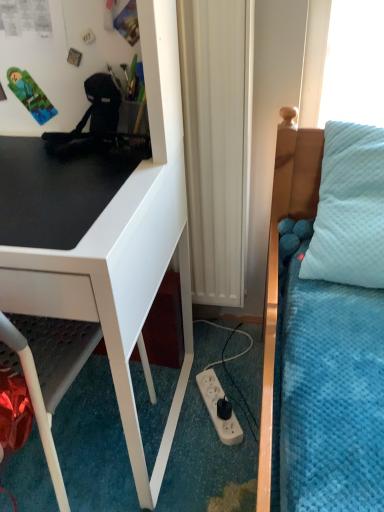
Question: Can you confirm if black matte desk at left is wider than white plastic power outlet at lower center?

Choices:
 (A) no
 (B) yes

Answer: (B)

Question: Is black matte desk at left at the right side of white plastic power outlet at lower center?

Choices:
 (A) no
 (B) yes

Answer: (A)

Question: From a real-world perspective, is black matte desk at left below white plastic power outlet at lower center?

Choices:
 (A) no
 (B) yes

Answer: (A)

Question: Is white plastic power outlet at lower center a part of black matte desk at left?

Choices:
 (A) no
 (B) yes

Answer: (A)

Question: Would you consider black matte desk at left to be distant from white plastic power outlet at lower center?

Choices:
 (A) no
 (B) yes

Answer: (A)

Question: Could you tell me if black matte desk at left is turned towards white plastic power outlet at lower center?

Choices:
 (A) no
 (B) yes

Answer: (A)

Question: Is white matte radiator at center to the right of white plastic power outlet at lower center from the viewer's perspective?

Choices:
 (A) yes
 (B) no

Answer: (B)

Question: From a real-world perspective, is white matte radiator at center beneath white plastic power outlet at lower center?

Choices:
 (A) no
 (B) yes

Answer: (A)

Question: Does white matte radiator at center turn towards white plastic power outlet at lower center?

Choices:
 (A) no
 (B) yes

Answer: (B)

Question: Can you confirm if white matte radiator at center is thinner than white plastic power outlet at lower center?

Choices:
 (A) yes
 (B) no

Answer: (A)

Question: Can you confirm if white matte radiator at center is shorter than white plastic power outlet at lower center?

Choices:
 (A) no
 (B) yes

Answer: (A)

Question: Is there a large distance between white matte radiator at center and white plastic power outlet at lower center?

Choices:
 (A) yes
 (B) no

Answer: (B)

Question: From the image's perspective, is white glossy desk at left beneath white plastic power outlet at lower center?

Choices:
 (A) no
 (B) yes

Answer: (A)